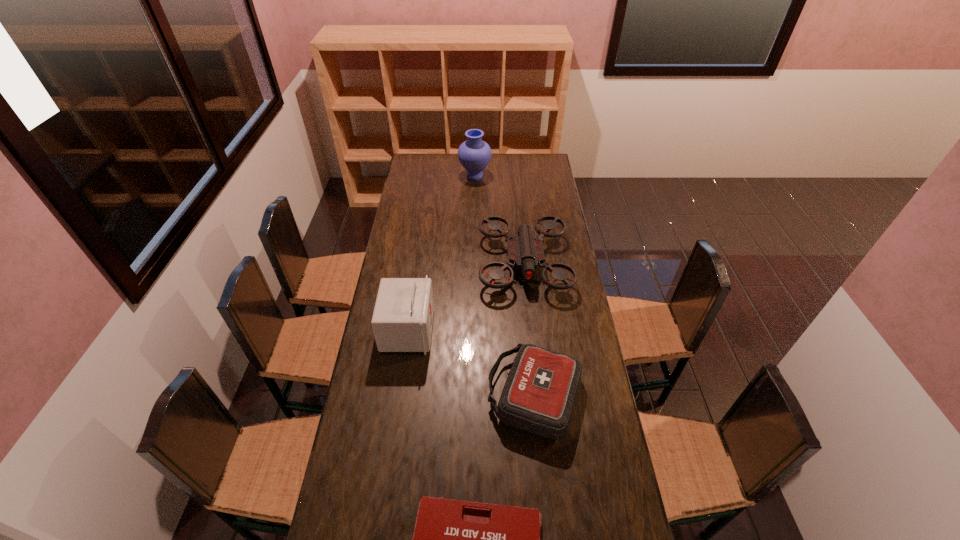
Locate an element on the screen. The height and width of the screenshot is (540, 960). object that is at the far edge is located at coordinates (474, 154).

Identify the location of object located at the left edge. The height and width of the screenshot is (540, 960). (402, 321).

Locate an element on the screen. This screenshot has height=540, width=960. drone that is at the right edge is located at coordinates point(525,251).

You are a GUI agent. You are given a task and a screenshot of the screen. Output one action in this format:
    pyautogui.click(x=<x>, y=<y>)
    Task: Click on the first-aid kit at the right edge
    
    Given the screenshot: What is the action you would take?
    pyautogui.click(x=539, y=394)

Locate an element on the screen. vacant space at the far edge is located at coordinates (466, 171).

Locate an element on the screen. This screenshot has height=540, width=960. vacant space at the left edge of the desktop is located at coordinates (367, 515).

In the image, there is a desktop. Where is `vacant space at the right edge`? The height and width of the screenshot is (540, 960). vacant space at the right edge is located at coordinates (540, 184).

Find the location of a particular element. The image size is (960, 540). free space that is in between the tallest first-aid kit and the second shortest object is located at coordinates (471, 362).

The height and width of the screenshot is (540, 960). In order to click on empty space that is in between the tallest first-aid kit and the farthest object in this screenshot , I will do `click(442, 253)`.

Locate an element on the screen. Image resolution: width=960 pixels, height=540 pixels. empty space between the vase and the fourth shortest object is located at coordinates (442, 253).